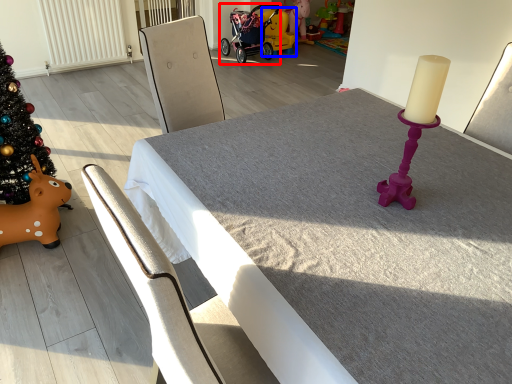
Question: Which of the following is the closest to the observer, baby carriage (highlighted by a red box) or toy (highlighted by a blue box)?

Choices:
 (A) baby carriage
 (B) toy

Answer: (A)